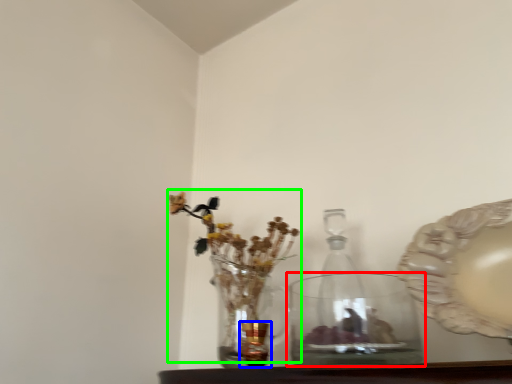
Question: Considering the real-world distances, which object is closest to vase (highlighted by a red box)? candle holder (highlighted by a blue box) or floral arrangement (highlighted by a green box).

Choices:
 (A) candle holder
 (B) floral arrangement

Answer: (B)